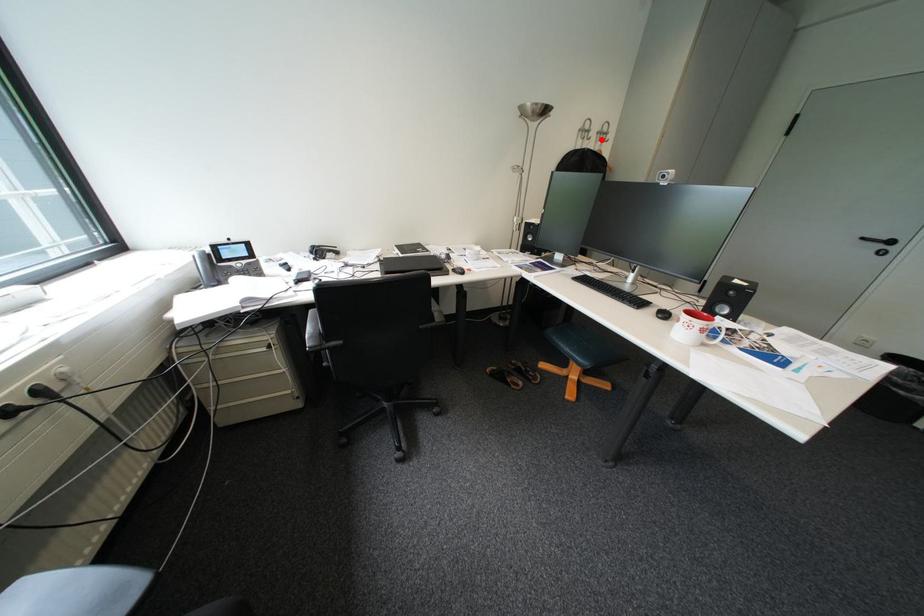
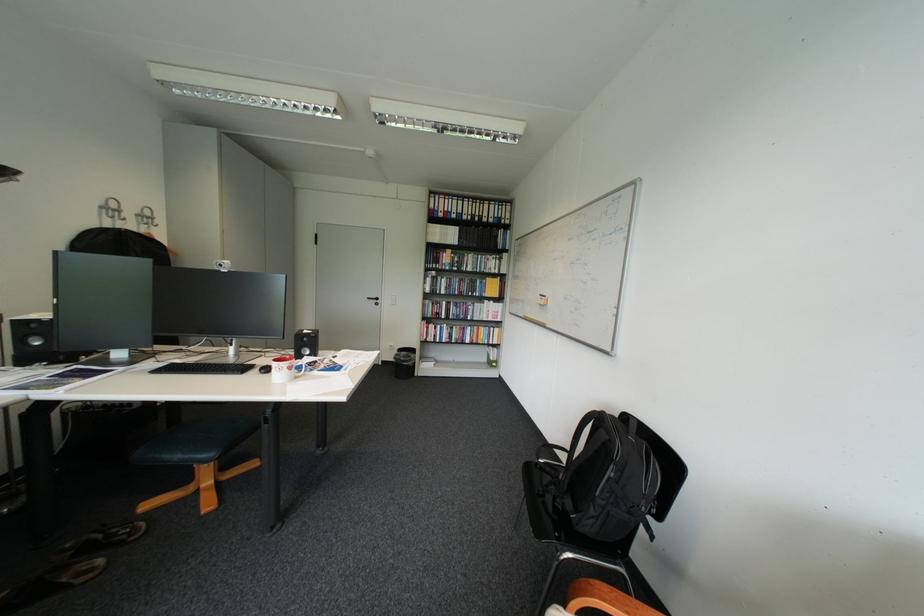
Question: I am providing you with two images of the same scene from different viewpoints. A red point is marked on the first image. Is the red point's position out of view in image 2?

Choices:
 (A) Yes
 (B) No

Answer: (B)